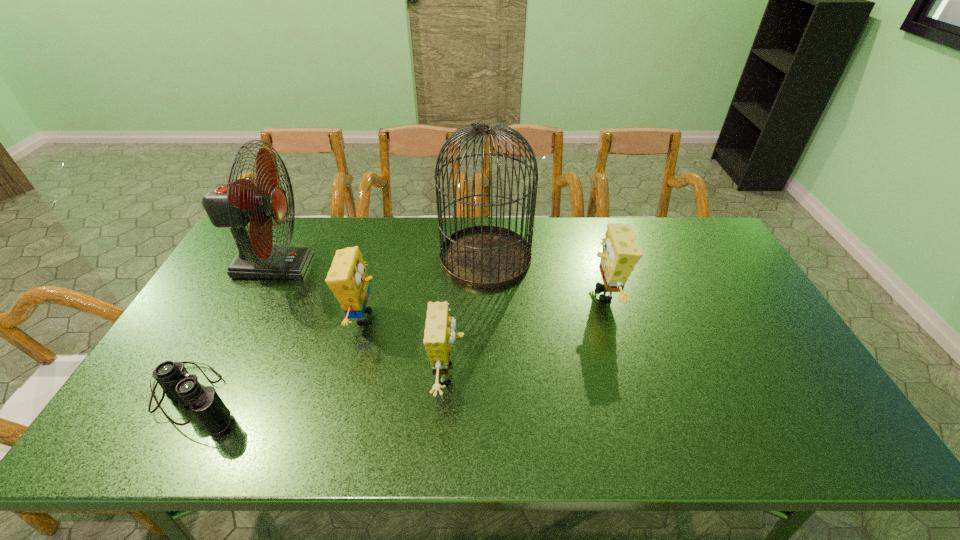
The height and width of the screenshot is (540, 960). In order to click on object situated at the far left corner in this screenshot , I will do `click(233, 205)`.

This screenshot has height=540, width=960. Find the location of `object that is at the near left corner`. object that is at the near left corner is located at coordinates (179, 386).

Image resolution: width=960 pixels, height=540 pixels. In order to click on free location at the far edge of the desktop in this screenshot , I will do `click(564, 259)`.

This screenshot has width=960, height=540. What are the coordinates of `free space at the near edge` in the screenshot? It's located at click(460, 450).

Where is `vacant space at the right edge`? Image resolution: width=960 pixels, height=540 pixels. vacant space at the right edge is located at coordinates (805, 395).

This screenshot has height=540, width=960. In the image, there is a desktop. In order to click on vacant region at the near left corner in this screenshot , I will do `click(150, 441)`.

Where is `vacant space at the far right corner of the desktop`? This screenshot has width=960, height=540. vacant space at the far right corner of the desktop is located at coordinates (711, 231).

The height and width of the screenshot is (540, 960). I want to click on vacant region between the birdcage and the leftmost sponge, so [x=424, y=287].

Where is `unoccupied area between the fourth object from right to left and the fan`? unoccupied area between the fourth object from right to left and the fan is located at coordinates coord(318,292).

Locate an element on the screen. free spot between the third object from left to right and the birdcage is located at coordinates (424, 287).